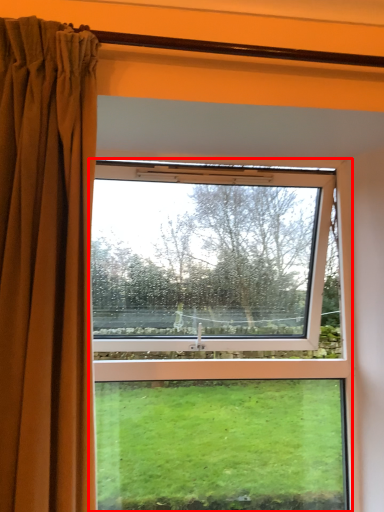
Question: From the image, what is the correct spatial relationship of window (annotated by the red box) in relation to curtain?

Choices:
 (A) right
 (B) left

Answer: (A)